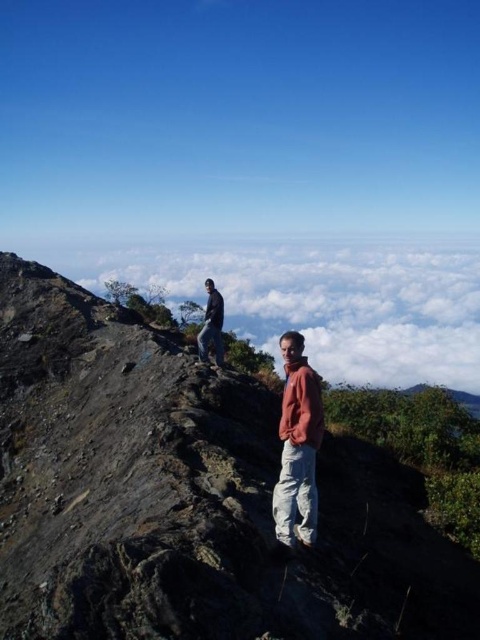
You are a photographer trying to capture a photo of the dark blue jacket at upper left and the white fluffy cloud at upper center. Based on their positions, which object is located to the right of the other?

The white fluffy cloud at upper center is positioned on the right side of dark blue jacket at upper left.

You are a photographer trying to capture a clear shot of the dark blue jacket at upper left without the white fluffy cloud at upper center blocking it. Based on their positions, is this possible?

The dark blue jacket at upper left is behind the white fluffy cloud at upper center, so the cloud would block the jacket in the shot.